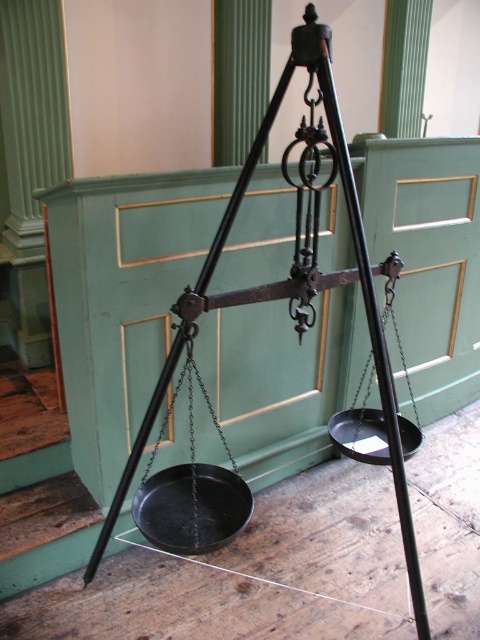
Question: Which object is farther from the camera taking this photo?

Choices:
 (A) black metal tripod at center
 (B) black matte scale at center
 (C) black metal pan at right

Answer: (C)

Question: Based on their relative distances, which object is nearer to the black metal pan at right?

Choices:
 (A) black matte scale at center
 (B) black metal tripod at center

Answer: (B)

Question: Among these objects, which one is nearest to the camera?

Choices:
 (A) black metal pan at right
 (B) black metal tripod at center

Answer: (B)

Question: Does black matte scale at center lie behind black metal pan at right?

Choices:
 (A) no
 (B) yes

Answer: (A)

Question: Is black matte scale at center thinner than black metal pan at right?

Choices:
 (A) yes
 (B) no

Answer: (B)

Question: Can you confirm if black metal tripod at center is bigger than black matte scale at center?

Choices:
 (A) yes
 (B) no

Answer: (A)